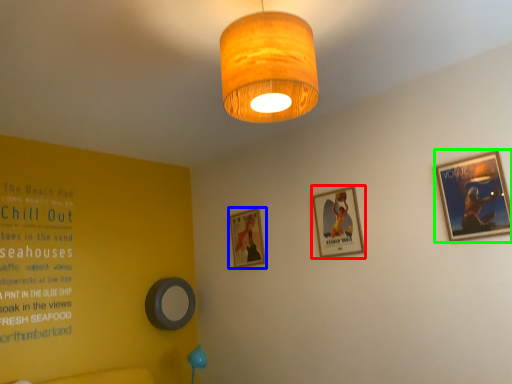
Question: Which object is positioned farthest from picture frame (highlighted by a red box)? Select from picture frame (highlighted by a blue box) and picture frame (highlighted by a green box).

Choices:
 (A) picture frame
 (B) picture frame

Answer: (B)